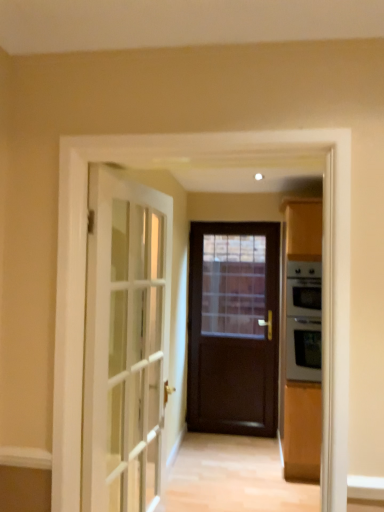
Question: In terms of width, does silver metallic oven at right look wider or thinner when compared to white glass door at left, placed as the second door when sorted from right to left?

Choices:
 (A) thin
 (B) wide

Answer: (B)

Question: From a real-world perspective, is silver metallic oven at right physically located above or below white glass door at left, which is the 1th door from left to right?

Choices:
 (A) below
 (B) above

Answer: (B)

Question: Which of these objects is positioned closest to the white glass door at left, placed as the second door when sorted from right to left?

Choices:
 (A) dark wood door at center, the first door in the back-to-front sequence
 (B) silver metallic oven at right

Answer: (B)

Question: Considering the real-world distances, which object is farthest from the silver metallic oven at right?

Choices:
 (A) dark wood door at center, which is counted as the 2th door, starting from the left
 (B) white glass door at left, which is the 1th door from left to right

Answer: (B)